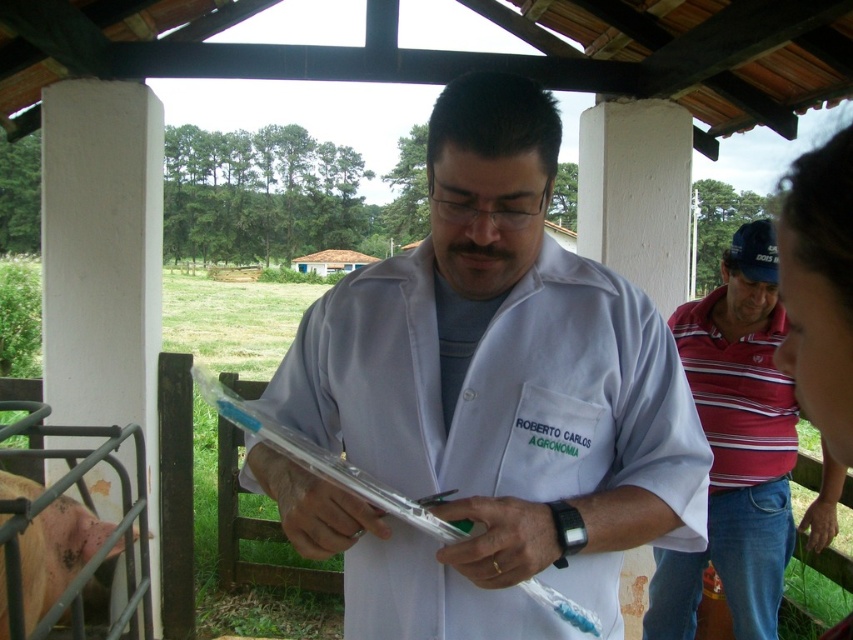
What are the coordinates of the white lab coat at center?

The white lab coat at center is located at coordinates point (486, 401).

Based on the scene description, what is the 2D coordinate of the white lab coat at center?

The 2D coordinate of the white lab coat at center is at point [486,401].